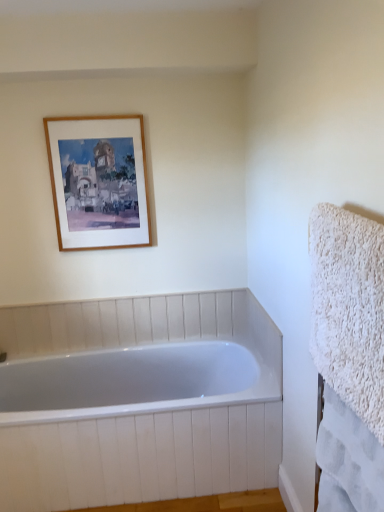
Question: Does white fluffy towel at right, the second bath towel when ordered from top to bottom, contain wooden frame at upper left?

Choices:
 (A) no
 (B) yes

Answer: (A)

Question: Does white fluffy towel at right, marked as the 1th bath towel in a bottom-to-top arrangement, have a smaller size compared to wooden frame at upper left?

Choices:
 (A) yes
 (B) no

Answer: (A)

Question: Is white fluffy towel at right, the second bath towel when ordered from top to bottom, taller than wooden frame at upper left?

Choices:
 (A) yes
 (B) no

Answer: (B)

Question: Is white fluffy towel at right, the second bath towel when ordered from top to bottom, to the right of wooden frame at upper left from the viewer's perspective?

Choices:
 (A) yes
 (B) no

Answer: (A)

Question: Is white fluffy towel at right, marked as the 1th bath towel in a bottom-to-top arrangement, not within wooden frame at upper left?

Choices:
 (A) no
 (B) yes

Answer: (B)

Question: From their relative heights in the image, would you say white glossy bathtub at center is taller or shorter than wooden frame at upper left?

Choices:
 (A) short
 (B) tall

Answer: (A)

Question: Considering the relative positions of white glossy bathtub at center and wooden frame at upper left in the image provided, is white glossy bathtub at center to the left or to the right of wooden frame at upper left?

Choices:
 (A) right
 (B) left

Answer: (A)

Question: Is white glossy bathtub at center in front of or behind wooden frame at upper left in the image?

Choices:
 (A) front
 (B) behind

Answer: (A)

Question: From a real-world perspective, is white glossy bathtub at center physically located above or below wooden frame at upper left?

Choices:
 (A) below
 (B) above

Answer: (A)

Question: Is white fluffy towel at right, the second bath towel when ordered from top to bottom, inside or outside of white glossy bathtub at center?

Choices:
 (A) outside
 (B) inside

Answer: (A)

Question: From the image's perspective, is white fluffy towel at right, marked as the 1th bath towel in a bottom-to-top arrangement, located above or below white glossy bathtub at center?

Choices:
 (A) above
 (B) below

Answer: (A)

Question: From a real-world perspective, is white fluffy towel at right, marked as the 1th bath towel in a bottom-to-top arrangement, above or below white glossy bathtub at center?

Choices:
 (A) above
 (B) below

Answer: (A)

Question: In terms of height, does white fluffy towel at right, marked as the 1th bath towel in a bottom-to-top arrangement, look taller or shorter compared to white glossy bathtub at center?

Choices:
 (A) short
 (B) tall

Answer: (A)

Question: Would you say white glossy bathtub at center is to the left or to the right of white fluffy towel at right, placed as the first bath towel when sorted from top to bottom, in the picture?

Choices:
 (A) right
 (B) left

Answer: (B)

Question: Considering their positions, is white glossy bathtub at center located in front of or behind white fluffy towel at right, placed as the first bath towel when sorted from top to bottom?

Choices:
 (A) front
 (B) behind

Answer: (B)